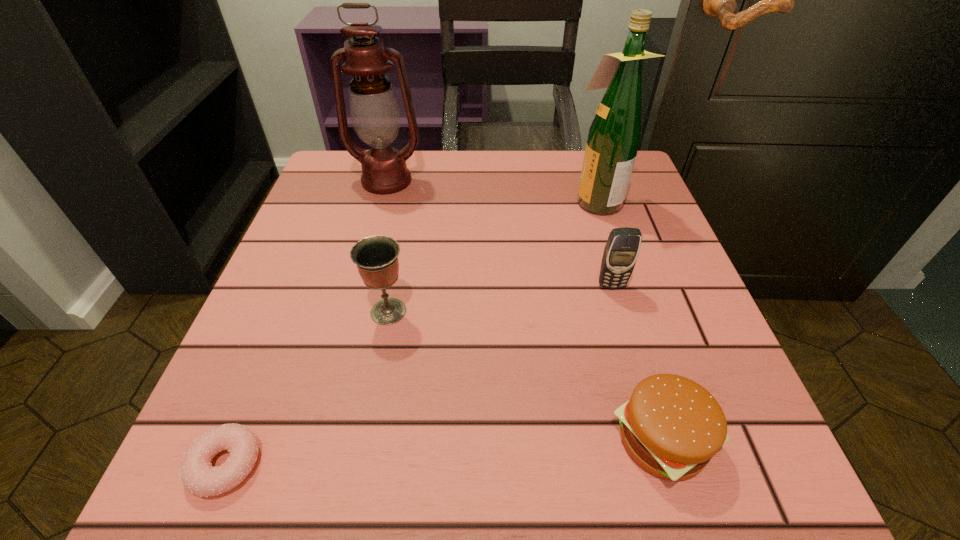
Locate an element on the screen. This screenshot has width=960, height=540. unoccupied position between the shortest object and the chalice is located at coordinates (307, 388).

Where is `unoccupied position between the fourth nearest object and the liquor`? Image resolution: width=960 pixels, height=540 pixels. unoccupied position between the fourth nearest object and the liquor is located at coordinates (604, 243).

This screenshot has height=540, width=960. In order to click on object that stands as the third closest to the doughnut in this screenshot , I will do `click(621, 251)`.

The image size is (960, 540). Identify the location of object that ranks as the fourth closest to the second shortest object. point(198,476).

The image size is (960, 540). What are the coordinates of `vacant space that satisfies the following two spatial constraints: 1. on the front-facing side of the liquor; 2. on the front face of the third farthest object` in the screenshot? It's located at (623, 286).

Where is `free location that satisfies the following two spatial constraints: 1. on the front side of the oil lamp; 2. on the right side of the fourth farthest object`? free location that satisfies the following two spatial constraints: 1. on the front side of the oil lamp; 2. on the right side of the fourth farthest object is located at coordinates (351, 312).